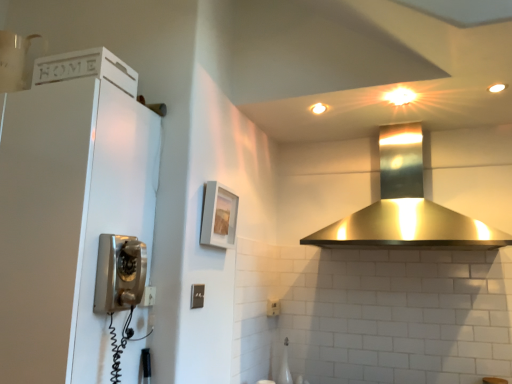
Question: Are white matte cabinet at left and satin silver light switch at center far apart?

Choices:
 (A) yes
 (B) no

Answer: (B)

Question: Does white matte cabinet at left turn towards satin silver light switch at center?

Choices:
 (A) yes
 (B) no

Answer: (B)

Question: Is white matte cabinet at left shorter than satin silver light switch at center?

Choices:
 (A) yes
 (B) no

Answer: (B)

Question: Can you confirm if white matte cabinet at left is thinner than satin silver light switch at center?

Choices:
 (A) no
 (B) yes

Answer: (A)

Question: Is white matte cabinet at left to the right of satin silver light switch at center from the viewer's perspective?

Choices:
 (A) yes
 (B) no

Answer: (B)

Question: Does white matte cabinet at left touch satin silver light switch at center?

Choices:
 (A) yes
 (B) no

Answer: (B)

Question: Does matte gray picture frame at center contain satin silver light switch at center?

Choices:
 (A) yes
 (B) no

Answer: (B)

Question: Is matte gray picture frame at center turned away from satin silver light switch at center?

Choices:
 (A) no
 (B) yes

Answer: (A)

Question: Can you confirm if matte gray picture frame at center is positioned to the left of satin silver light switch at center?

Choices:
 (A) yes
 (B) no

Answer: (B)

Question: Is matte gray picture frame at center outside of satin silver light switch at center?

Choices:
 (A) no
 (B) yes

Answer: (B)

Question: Is matte gray picture frame at center positioned behind satin silver light switch at center?

Choices:
 (A) no
 (B) yes

Answer: (B)

Question: Is the depth of matte gray picture frame at center less than that of satin silver light switch at center?

Choices:
 (A) no
 (B) yes

Answer: (A)

Question: Does matte gray picture frame at center appear on the right side of white matte cabinet at left?

Choices:
 (A) yes
 (B) no

Answer: (A)